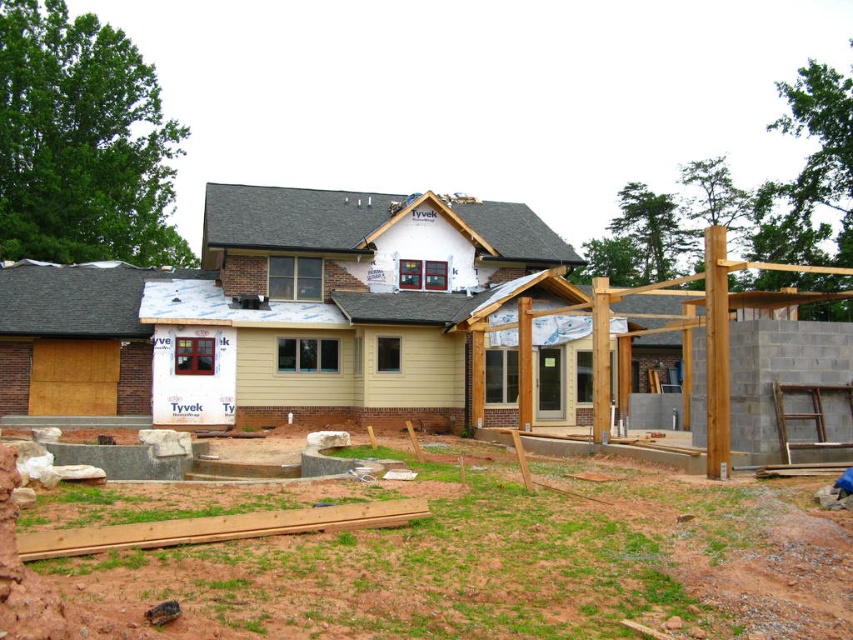
Is beige siding at center smaller than green grass at lower center?

No, beige siding at center is not smaller than green grass at lower center.

Can you confirm if beige siding at center is positioned below green grass at lower center?

No, beige siding at center is not below green grass at lower center.

The width and height of the screenshot is (853, 640). What do you see at coordinates (283, 314) in the screenshot? I see `beige siding at center` at bounding box center [283, 314].

Where is `beige siding at center`? beige siding at center is located at coordinates (283, 314).